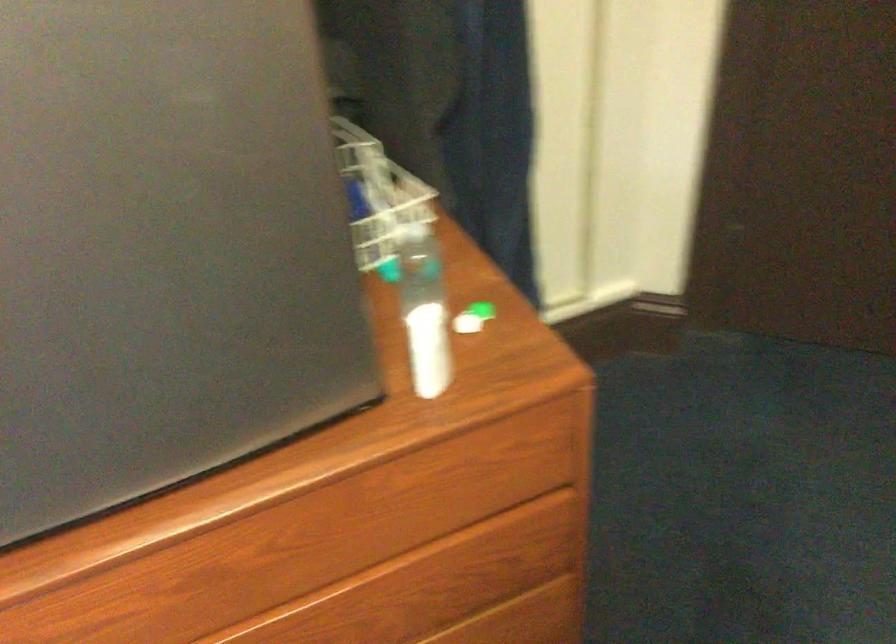
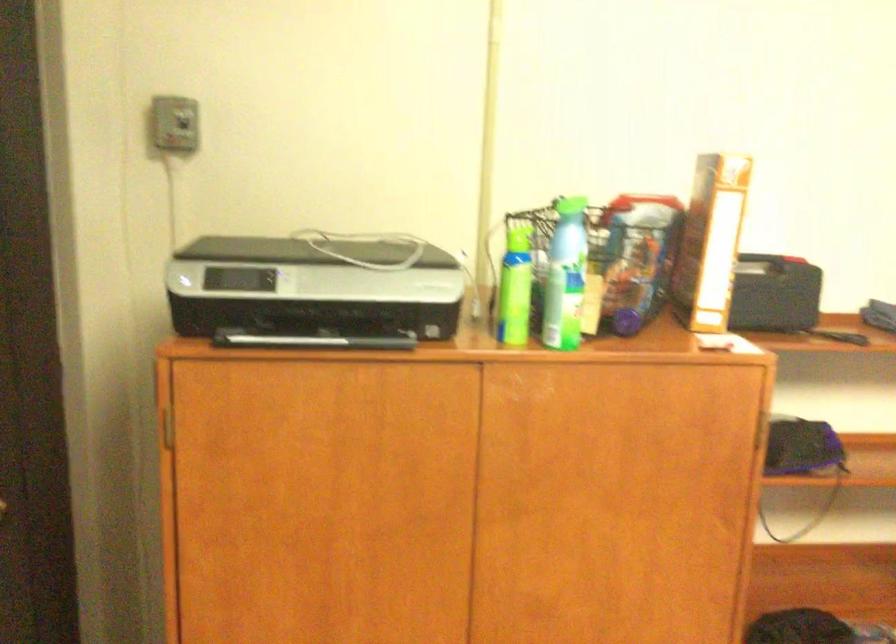
Question: How did the camera likely rotate?

Choices:
 (A) Left
 (B) Right
 (C) Up
 (D) Down

Answer: (B)